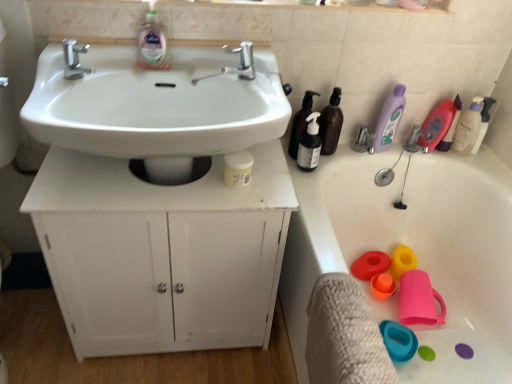
This screenshot has height=384, width=512. I want to click on free spot to the left of polished chrome tap at upper center, which ranks as the 1th tap in right-to-left order, so click(x=201, y=65).